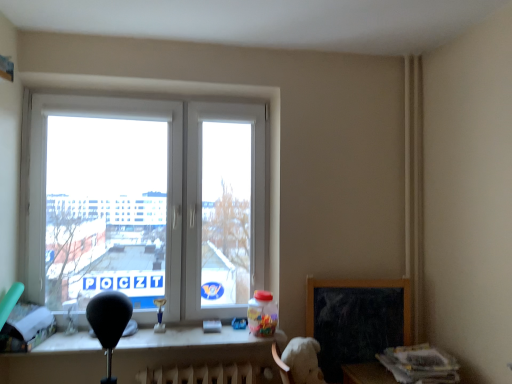
Find the location of a particular element. The height and width of the screenshot is (384, 512). white plastic window at center is located at coordinates (148, 203).

Is there a large distance between white plastic window at center and white plastic table at lower center?

Yes, white plastic window at center and white plastic table at lower center are located far from each other.

Between white plastic window at center and white plastic table at lower center, which one is positioned behind?

Positioned behind is white plastic window at center.

How many degrees apart are the facing directions of white plastic window at center and white plastic table at lower center?

The angle between the facing direction of white plastic window at center and the facing direction of white plastic table at lower center is 0.00113 degrees.

Is white plastic window at center aimed at white plastic table at lower center?

Yes, white plastic window at center is facing white plastic table at lower center.

From the image's perspective, is black matte chalkboard at lower right positioned above or below white plastic window at center?

black matte chalkboard at lower right is below white plastic window at center.

Choose the correct answer: Is black matte chalkboard at lower right inside white plastic window at center or outside it?

black matte chalkboard at lower right lies outside white plastic window at center.

Looking at this image, which of these two, black matte chalkboard at lower right or white plastic window at center, is wider?

white plastic window at center.

Who is bigger, black matte chalkboard at lower right or white plastic window at center?

Bigger between the two is white plastic window at center.

In the image, is white plastic table at lower center on the left side or the right side of white plastic window at center?

Clearly, white plastic table at lower center is on the right of white plastic window at center in the image.

Considering the relative positions of white plastic table at lower center and white plastic window at center in the image provided, is white plastic table at lower center behind white plastic window at center?

No, white plastic table at lower center is in front of white plastic window at center.

Which object is wider, white plastic table at lower center or white plastic window at center?

white plastic table at lower center.

Is white plastic table at lower center taller or shorter than white plastic window at center?

white plastic table at lower center is shorter than white plastic window at center.

Consider the image. How much distance is there between white plastic table at lower center and black matte chalkboard at lower right?

The distance of white plastic table at lower center from black matte chalkboard at lower right is 63.95 centimeters.

Are white plastic table at lower center and black matte chalkboard at lower right located far from each other?

white plastic table at lower center is actually quite close to black matte chalkboard at lower right.

Could you tell me if white plastic table at lower center is facing black matte chalkboard at lower right?

No, white plastic table at lower center is not aimed at black matte chalkboard at lower right.

In terms of height, does white plastic table at lower center look taller or shorter compared to black matte chalkboard at lower right?

Clearly, white plastic table at lower center is shorter compared to black matte chalkboard at lower right.

How much distance is there between black matte chalkboard at lower right and white plastic table at lower center?

25.18 inches.

Considering the relative positions of black matte chalkboard at lower right and white plastic table at lower center in the image provided, is black matte chalkboard at lower right to the left or to the right of white plastic table at lower center?

black matte chalkboard at lower right is to the right of white plastic table at lower center.

From the picture: Could white plastic table at lower center be considered to be inside black matte chalkboard at lower right?

No.

Where is `window screen above the white plastic table at lower center (from the image's perspective)`? Image resolution: width=512 pixels, height=384 pixels. window screen above the white plastic table at lower center (from the image's perspective) is located at coordinates (356, 320).

Are white plastic window at center and black matte chalkboard at lower right making contact?

No, white plastic window at center is not touching black matte chalkboard at lower right.

Where is `window to the left of black matte chalkboard at lower right`? window to the left of black matte chalkboard at lower right is located at coordinates (148, 203).

Considering the relative sizes of white plastic window at center and black matte chalkboard at lower right in the image provided, is white plastic window at center shorter than black matte chalkboard at lower right?

No, white plastic window at center is not shorter than black matte chalkboard at lower right.

Is white plastic window at center at the left side of black matte chalkboard at lower right?

Correct, you'll find white plastic window at center to the left of black matte chalkboard at lower right.

This screenshot has height=384, width=512. In order to click on table directly beneath the white plastic window at center (from a real-world perspective) in this screenshot , I will do `click(193, 350)`.

The width and height of the screenshot is (512, 384). What are the coordinates of `window screen behind the white plastic window at center` in the screenshot? It's located at (356, 320).

Estimate the real-world distances between objects in this image. Which object is closer to white plastic table at lower center, black matte chalkboard at lower right or white plastic window at center?

Among the two, black matte chalkboard at lower right is located nearer to white plastic table at lower center.

Which object lies nearer to the anchor point black matte chalkboard at lower right, white plastic table at lower center or white plastic window at center?

white plastic table at lower center is positioned closer to the anchor black matte chalkboard at lower right.

Which object lies nearer to the anchor point white plastic window at center, black matte chalkboard at lower right or white plastic table at lower center?

The object closer to white plastic window at center is white plastic table at lower center.

Based on their spatial positions, is white plastic window at center or white plastic table at lower center further from black matte chalkboard at lower right?

Based on the image, white plastic window at center appears to be further to black matte chalkboard at lower right.

Estimate the real-world distances between objects in this image. Which object is closer to white plastic table at lower center, white plastic window at center or black matte chalkboard at lower right?

Among the two, black matte chalkboard at lower right is located nearer to white plastic table at lower center.

Estimate the real-world distances between objects in this image. Which object is closer to white plastic window at center, white plastic table at lower center or black matte chalkboard at lower right?

white plastic table at lower center.

Where is `table located between white plastic window at center and black matte chalkboard at lower right in the left-right direction`? This screenshot has height=384, width=512. table located between white plastic window at center and black matte chalkboard at lower right in the left-right direction is located at coordinates (193, 350).